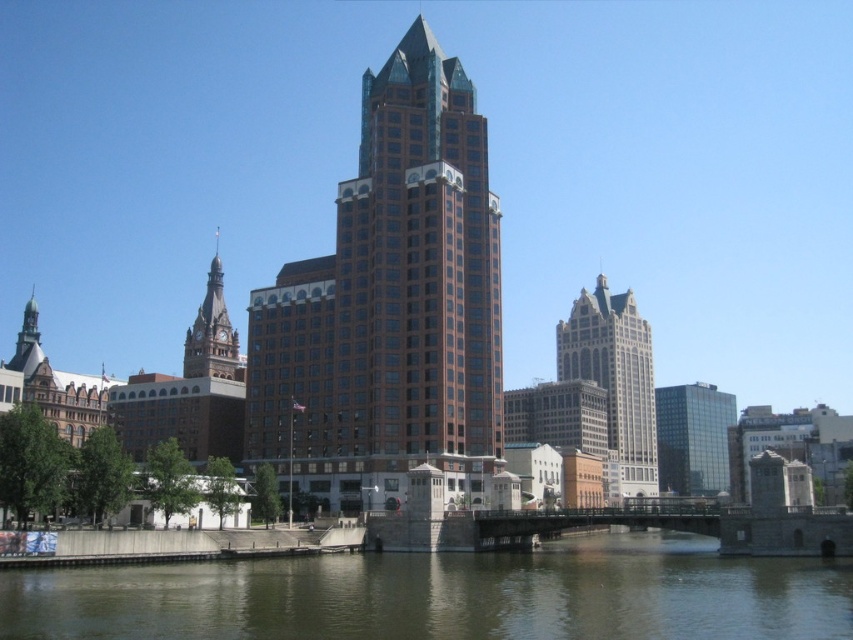
You are a city planner assessing the feasibility of installing a new public walkway between the brown murky water at lower center and the glassy reflective building at right. The walkway requires a minimum clearance of 100 meters between the two points. Based on the scene description, will the existing distance accommodate this requirement?

The distance between the brown murky water at lower center and the glassy reflective building at right is 112.70 meters, which exceeds the required 100 meters clearance. Therefore, the walkway can be installed between them.

Looking at this image, you are a city planner evaluating the cityscape. You notice the brown murky water at lower center and the glassy reflective building at right. Which of these two elements occupies a larger area in the scene?

The glassy reflective building at right occupies a larger area in the scene because the brown murky water at lower center has a smaller size compared to it.

You are a drone operator tasked with flying a drone between the brown glassy building at center and the brick steeple at left. The drone has a maximum flight distance of 30 meters. Can the drone safely make this flight without exceeding its range?

The brown glassy building at center and brick steeple at left are 33.75 meters apart. Since the drone can only fly up to 30 meters, it cannot safely make the flight between them as the distance exceeds its maximum range.